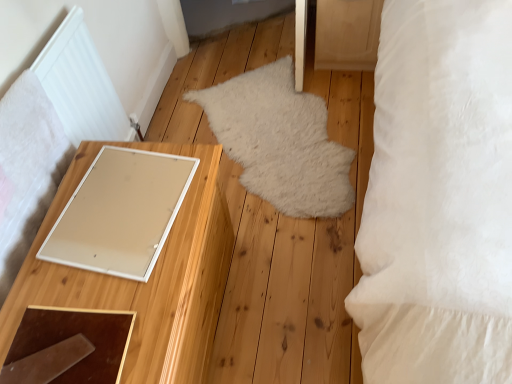
Question: Does white soft pillow at right have a larger size compared to white fluffy rug at center?

Choices:
 (A) yes
 (B) no

Answer: (A)

Question: From the image's perspective, would you say white soft pillow at right is shown under white fluffy rug at center?

Choices:
 (A) yes
 (B) no

Answer: (B)

Question: Is white soft pillow at right positioned in front of white fluffy rug at center?

Choices:
 (A) no
 (B) yes

Answer: (B)

Question: Is white soft pillow at right in contact with white fluffy rug at center?

Choices:
 (A) yes
 (B) no

Answer: (B)

Question: Is white soft pillow at right facing away from white fluffy rug at center?

Choices:
 (A) no
 (B) yes

Answer: (A)

Question: Considering the positions of wooden drawer at upper right and white soft pillow at right in the image, is wooden drawer at upper right bigger or smaller than white soft pillow at right?

Choices:
 (A) big
 (B) small

Answer: (B)

Question: Visually, is wooden drawer at upper right positioned to the left or to the right of white soft pillow at right?

Choices:
 (A) right
 (B) left

Answer: (B)

Question: Considering their positions, is wooden drawer at upper right located in front of or behind white soft pillow at right?

Choices:
 (A) behind
 (B) front

Answer: (A)

Question: From the image's perspective, is wooden drawer at upper right located above or below white soft pillow at right?

Choices:
 (A) below
 (B) above

Answer: (B)

Question: From a real-world perspective, is white matte mirror at left above or below white soft pillow at right?

Choices:
 (A) above
 (B) below

Answer: (B)

Question: In terms of width, does white matte mirror at left look wider or thinner when compared to white soft pillow at right?

Choices:
 (A) thin
 (B) wide

Answer: (A)

Question: Is white matte mirror at left in front of or behind white soft pillow at right in the image?

Choices:
 (A) behind
 (B) front

Answer: (A)

Question: Based on their positions, is white matte mirror at left located to the left or right of white soft pillow at right?

Choices:
 (A) left
 (B) right

Answer: (A)

Question: In terms of width, does wooden drawer at upper right look wider or thinner when compared to white fluffy rug at center?

Choices:
 (A) thin
 (B) wide

Answer: (A)

Question: From the image's perspective, is wooden drawer at upper right positioned above or below white fluffy rug at center?

Choices:
 (A) above
 (B) below

Answer: (A)